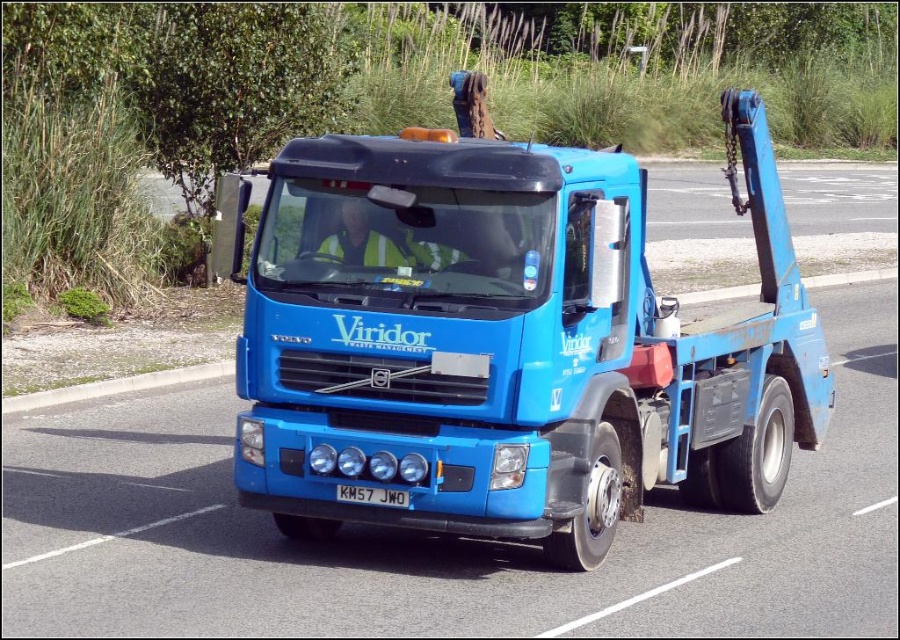
Find the location of a particular element. This screenshot has height=640, width=900. blue matte tow truck at center is located at coordinates (509, 342).

Who is higher up, blue matte tow truck at center or blue metallic truck at center?

blue matte tow truck at center is higher up.

Is point (411, 212) in front of point (608, 595)?

Yes, it is.

Locate an element on the screen. The height and width of the screenshot is (640, 900). blue matte tow truck at center is located at coordinates (509, 342).

Does blue metallic truck at center have a lesser width compared to black metal/license plate at center?

No, blue metallic truck at center is not thinner than black metal/license plate at center.

Does blue metallic truck at center appear on the right side of black metal/license plate at center?

Indeed, blue metallic truck at center is positioned on the right side of black metal/license plate at center.

The width and height of the screenshot is (900, 640). What do you see at coordinates (436, 538) in the screenshot?
I see `blue metallic truck at center` at bounding box center [436, 538].

Identify the location of blue metallic truck at center. (436, 538).

Does blue matte tow truck at center appear on the left side of black metal/license plate at center?

No, blue matte tow truck at center is not to the left of black metal/license plate at center.

Can you confirm if blue matte tow truck at center is wider than black metal/license plate at center?

In fact, blue matte tow truck at center might be narrower than black metal/license plate at center.

Image resolution: width=900 pixels, height=640 pixels. Find the location of `blue matte tow truck at center`. blue matte tow truck at center is located at coordinates (509, 342).

This screenshot has width=900, height=640. Find the location of `blue matte tow truck at center`. blue matte tow truck at center is located at coordinates (509, 342).